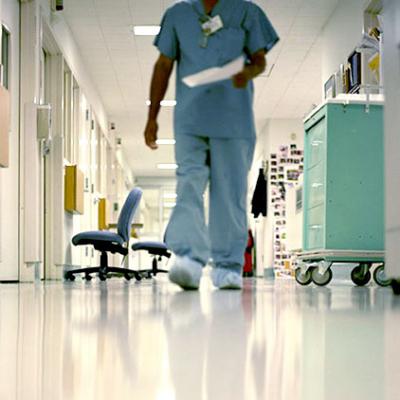
Locate an element on the screen. This screenshot has width=400, height=400. wall of photographs is located at coordinates (284, 264), (279, 220), (284, 166), (300, 148).